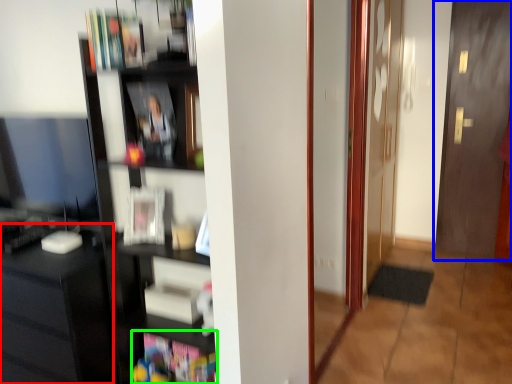
Question: Based on their relative distances, which object is nearer to computer desk (highlighted by a red box)? Choose from door (highlighted by a blue box) and book (highlighted by a green box).

Choices:
 (A) door
 (B) book

Answer: (B)